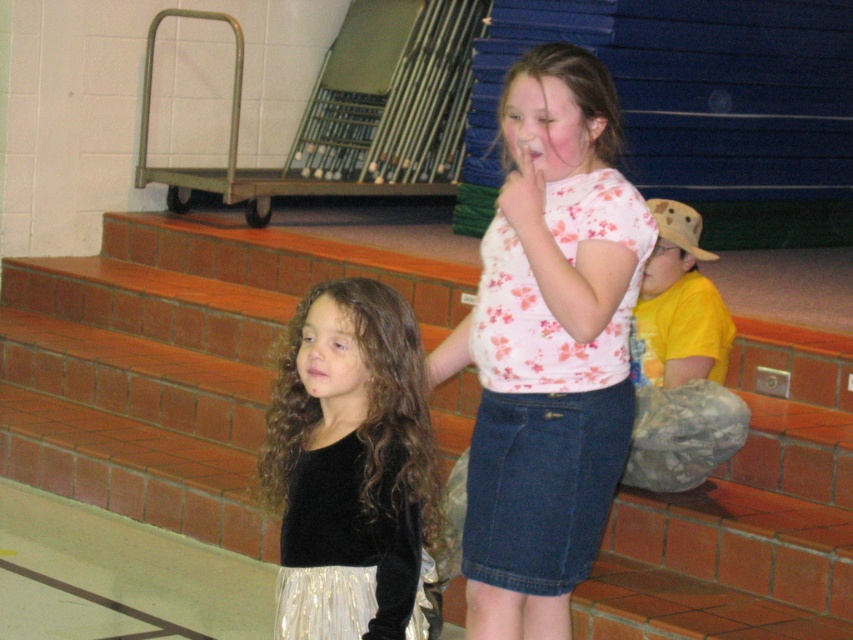
You are a photographer setting up a tripod at point (172, 362). The brick stairs at center are in your way. Can you move the tripod to a different position so it doesn not block the stairs?

The point (172, 362) is on the brick stairs at center, so moving the tripod to a different position away from the stairs would prevent it from blocking them.

You are a photographer trying to capture a candid shot of the children in the gymnasium. You notice the brick stairs at center and the floral cotton shirt at center. Which object is located higher in the image?

The brick stairs at center are positioned over the floral cotton shirt at center, so they are higher in the image.

You are a photographer trying to capture a group photo of the children in the gymnasium. You notice two girls wearing the floral cotton shirt at center and the black velvet top at center. Which child should you focus on first if you want to ensure both are in the frame without moving the camera? Please explain based on their positions.

The floral cotton shirt at center is positioned on the right side of the black velvet top at center. To include both in the frame without moving the camera, focus on the black velvet top at center first since it is closer to the left, allowing the floral cotton shirt at center to naturally fall into the right side of the frame.